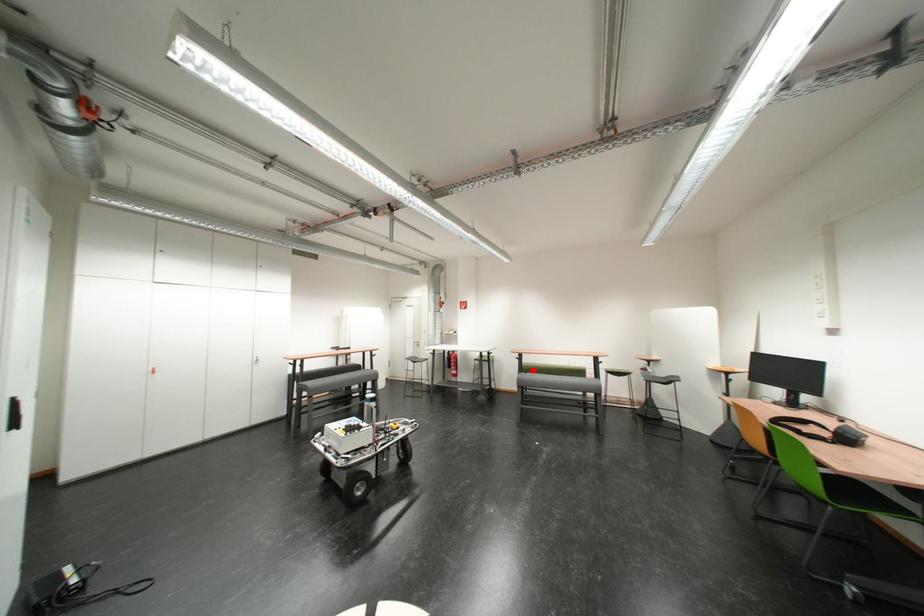
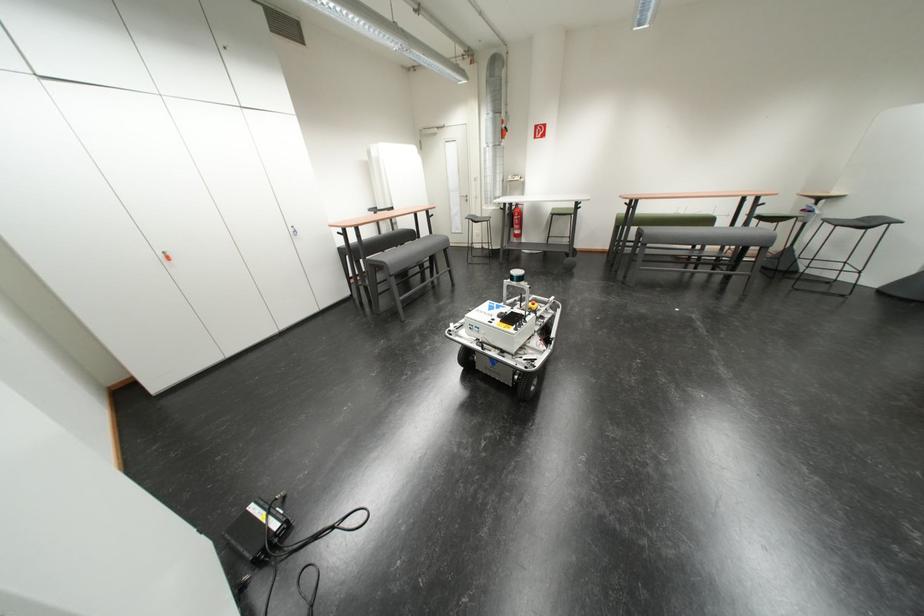
The point at the highlighted location is marked in the first image. Where is the corresponding point in the second image?

(638, 223)